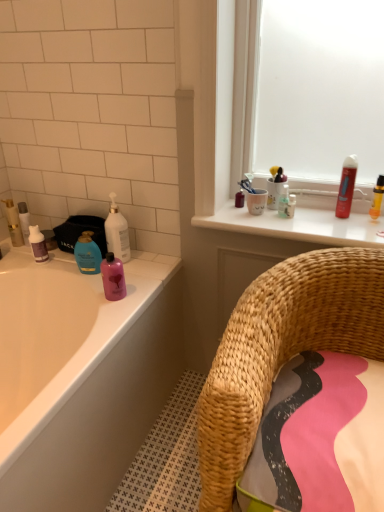
Locate an element on the screen. vacant space that is in between translucent plastic toothbrush holder at upper center, the 5th toiletry when ordered from left to right, and translucent yellow bottle at upper right, positioned as the first toiletry in right-to-left order is located at coordinates [324, 221].